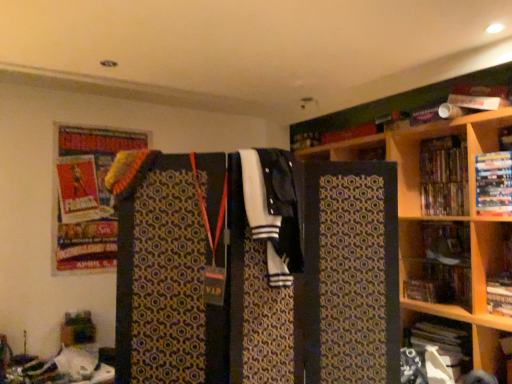
Question: Is wooden bookshelf at right at the back of hardcover book at upper right, the third book positioned from the bottom?

Choices:
 (A) yes
 (B) no

Answer: (B)

Question: Is hardcover book at upper right, the 2th book positioned from the top, oriented towards wooden bookshelf at right?

Choices:
 (A) yes
 (B) no

Answer: (B)

Question: Can you confirm if hardcover book at upper right, the 2th book positioned from the top, is thinner than wooden bookshelf at right?

Choices:
 (A) yes
 (B) no

Answer: (B)

Question: Is hardcover book at upper right, the third book positioned from the bottom, wider than wooden bookshelf at right?

Choices:
 (A) yes
 (B) no

Answer: (A)

Question: Is hardcover book at upper right, the third book positioned from the bottom, beside wooden bookshelf at right?

Choices:
 (A) yes
 (B) no

Answer: (B)

Question: Is white paper at lower right, placed as the 1th book when sorted from bottom to top, in front of or behind hardcover book at right, the 3th book positioned from the top, in the image?

Choices:
 (A) behind
 (B) front

Answer: (B)

Question: In terms of width, does white paper at lower right, placed as the fourth book when sorted from top to bottom, look wider or thinner when compared to hardcover book at right, the 2th book positioned from the bottom?

Choices:
 (A) wide
 (B) thin

Answer: (A)

Question: In the image, is white paper at lower right, placed as the fourth book when sorted from top to bottom, on the left side or the right side of hardcover book at right, the 2th book positioned from the bottom?

Choices:
 (A) right
 (B) left

Answer: (B)

Question: Considering the positions of white paper at lower right, placed as the 1th book when sorted from bottom to top, and hardcover book at right, the 3th book positioned from the top, in the image, is white paper at lower right, placed as the 1th book when sorted from bottom to top, taller or shorter than hardcover book at right, the 3th book positioned from the top,?

Choices:
 (A) tall
 (B) short

Answer: (A)

Question: Choose the correct answer: Is hardcover book at right, the 2th book positioned from the bottom, inside wooden bookshelf at right or outside it?

Choices:
 (A) inside
 (B) outside

Answer: (B)

Question: From a real-world perspective, is hardcover book at right, the 2th book positioned from the bottom, physically located above or below wooden bookshelf at right?

Choices:
 (A) below
 (B) above

Answer: (A)

Question: In terms of width, does hardcover book at right, the 2th book positioned from the bottom, look wider or thinner when compared to wooden bookshelf at right?

Choices:
 (A) thin
 (B) wide

Answer: (B)

Question: From the image's perspective, is hardcover book at right, the 2th book positioned from the bottom, located above or below wooden bookshelf at right?

Choices:
 (A) below
 (B) above

Answer: (A)

Question: From the image's perspective, is hardcover book at upper right, the third book positioned from the bottom, located above or below white and black fabric at center?

Choices:
 (A) above
 (B) below

Answer: (A)

Question: Considering the positions of hardcover book at upper right, the 2th book positioned from the top, and white and black fabric at center in the image, is hardcover book at upper right, the 2th book positioned from the top, taller or shorter than white and black fabric at center?

Choices:
 (A) tall
 (B) short

Answer: (B)